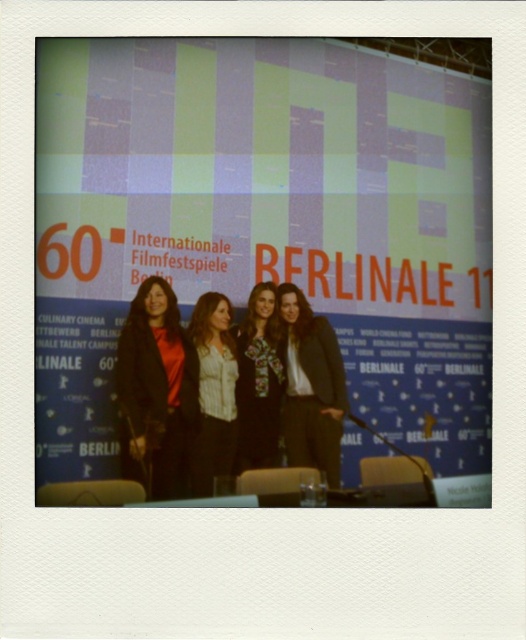
From the picture: You are at the Berlinale film festival and need to locate the exact position of the point marked as point (x=266, y=224). According to the scene description, where would this point be located?

The point (x=266, y=224) is on the matte blue backdrop at center.